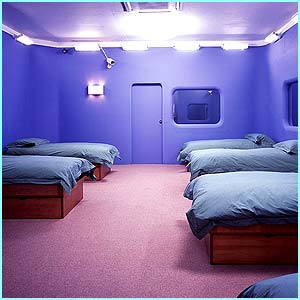
Find the location of a particular element. door is located at coordinates (160, 127).